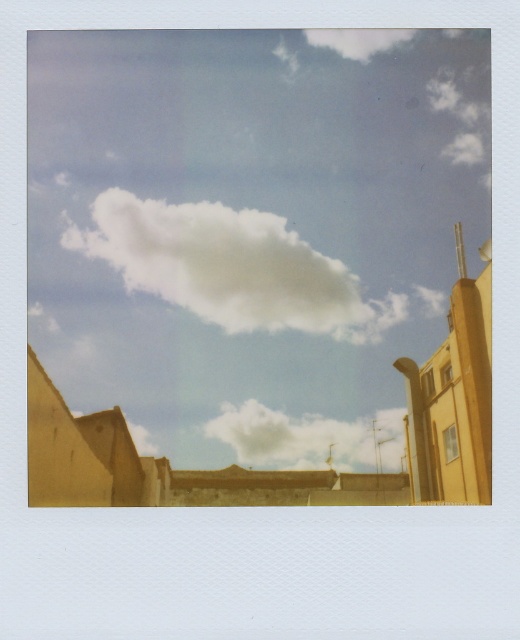
Describe the element at coordinates (226, 266) in the screenshot. I see `white fluffy cloud at upper center` at that location.

Who is more distant from viewer, (331, 328) or (346, 461)?

The point (346, 461) is behind.

Where is `white fluffy cloud at upper center`? This screenshot has height=640, width=520. white fluffy cloud at upper center is located at coordinates (226, 266).